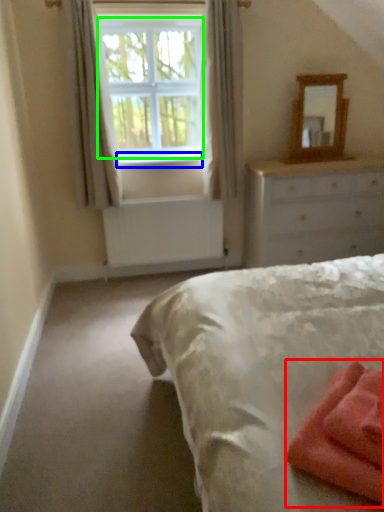
Question: Estimate the real-world distances between objects in this image. Which object is farther from material (highlighted by a red box), window sill (highlighted by a blue box) or window screen (highlighted by a green box)?

Choices:
 (A) window sill
 (B) window screen

Answer: (B)